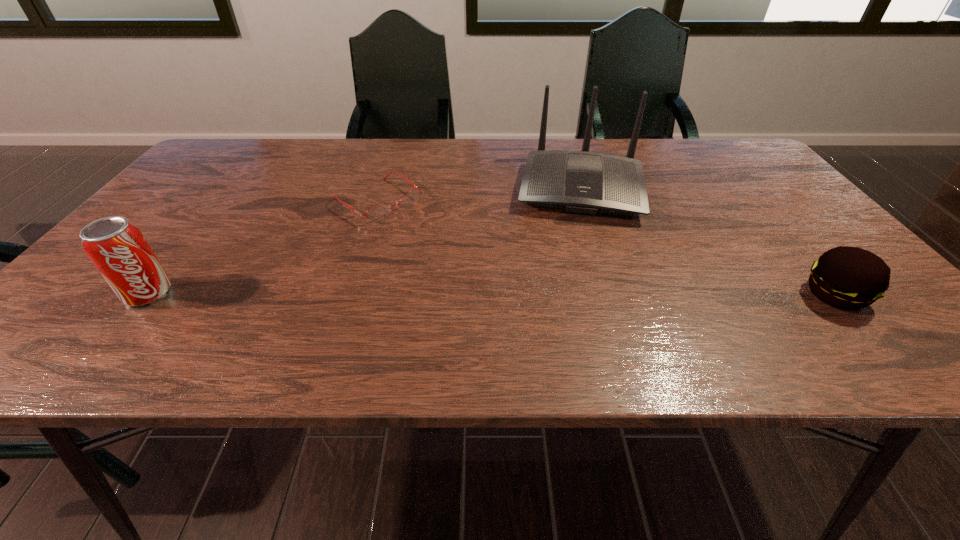
Locate an element on the screen. The height and width of the screenshot is (540, 960). object at the right edge is located at coordinates (849, 278).

Image resolution: width=960 pixels, height=540 pixels. Identify the location of object positioned at the near left corner. (117, 248).

Locate an element on the screen. This screenshot has height=540, width=960. object that is positioned at the near right corner is located at coordinates (849, 278).

In order to click on blank area at the far edge in this screenshot , I will do `click(652, 153)`.

Image resolution: width=960 pixels, height=540 pixels. I want to click on free space at the near edge, so click(x=480, y=296).

In the image, there is a desktop. Where is `vacant space at the right edge`? vacant space at the right edge is located at coordinates (740, 185).

In the image, there is a desktop. Where is `vacant space at the far left corner`? The width and height of the screenshot is (960, 540). vacant space at the far left corner is located at coordinates (260, 140).

Where is `vacant space at the far right corner`? The image size is (960, 540). vacant space at the far right corner is located at coordinates (730, 152).

You are a GUI agent. You are given a task and a screenshot of the screen. Output one action in this format:
    pyautogui.click(x=<x>, y=<y>)
    Task: Click on the vacant space that's between the soda can and the second shortest object
    Image resolution: width=960 pixels, height=540 pixels.
    Given the screenshot: What is the action you would take?
    pyautogui.click(x=492, y=294)

Where is `free space between the second object from left to right and the third tallest object`? The width and height of the screenshot is (960, 540). free space between the second object from left to right and the third tallest object is located at coordinates (606, 247).